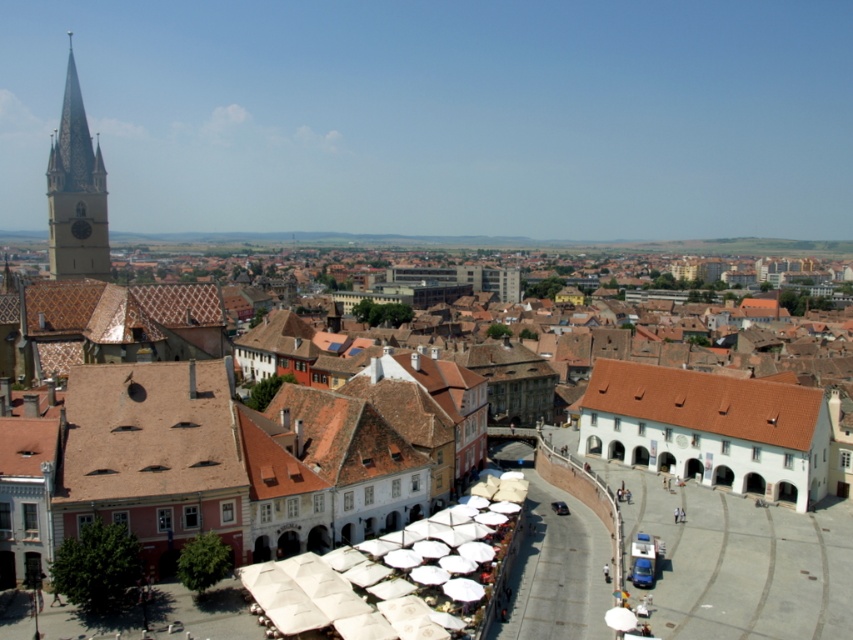
Question: Is matte white umbrellas at center to the right of matte stone clock tower at upper left from the viewer's perspective?

Choices:
 (A) yes
 (B) no

Answer: (A)

Question: Can you confirm if white fabric umbrella at center is bigger than matte stone clock tower at upper left?

Choices:
 (A) no
 (B) yes

Answer: (A)

Question: Which point is farther to the camera?

Choices:
 (A) white fabric umbrella at center
 (B) matte stone clock tower at upper left

Answer: (B)

Question: Among these objects, which one is nearest to the camera?

Choices:
 (A) matte white umbrellas at center
 (B) white fabric umbrella at center
 (C) matte stone clock tower at upper left

Answer: (B)

Question: Considering the relative positions of white fabric umbrella at center and matte white umbrellas at center in the image provided, where is white fabric umbrella at center located with respect to matte white umbrellas at center?

Choices:
 (A) above
 (B) below

Answer: (B)

Question: Which of the following is the closest to the observer?

Choices:
 (A) white fabric umbrella at center
 (B) matte white umbrellas at center
 (C) matte stone clock tower at upper left

Answer: (A)